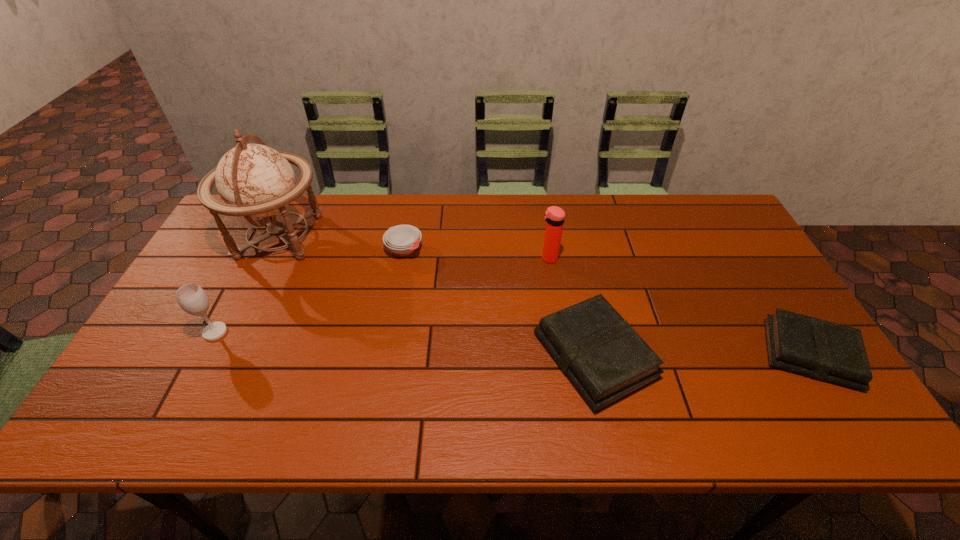
At what (x,y) coordinates should I click in order to perform the action: click on object that is at the near right corner. Please return your answer as a coordinate pair (x, y). This screenshot has width=960, height=540. Looking at the image, I should click on tap(818, 349).

The height and width of the screenshot is (540, 960). Find the location of `free space at the far edge`. free space at the far edge is located at coordinates (671, 201).

Locate an element on the screen. This screenshot has height=540, width=960. vacant space at the near edge is located at coordinates (692, 374).

In the image, there is a desktop. What are the coordinates of `free space at the left edge` in the screenshot? It's located at (182, 362).

I want to click on free space at the right edge of the desktop, so click(x=744, y=280).

Locate an element on the screen. This screenshot has width=960, height=540. vacant space at the far right corner of the desktop is located at coordinates (727, 211).

What are the coordinates of `empty space that is in between the third tallest object and the third object from left to right` in the screenshot? It's located at (310, 291).

You are a GUI agent. You are given a task and a screenshot of the screen. Output one action in this format:
    pyautogui.click(x=<x>, y=<y>)
    Task: Click on the empty space that is in between the fourth tallest object and the right book
    
    Given the screenshot: What is the action you would take?
    pyautogui.click(x=702, y=355)

Locate an element on the screen. The width and height of the screenshot is (960, 540). unoccupied position between the wineglass and the right book is located at coordinates (513, 343).

Where is `unoccupied position between the taller book and the third object from left to right`? unoccupied position between the taller book and the third object from left to right is located at coordinates (499, 302).